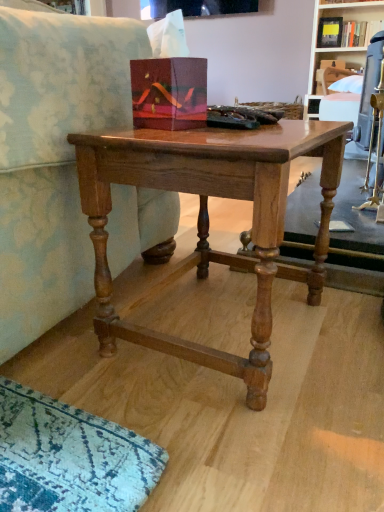
Question: Is point (329, 64) positioned closer to the camera than point (102, 201)?

Choices:
 (A) farther
 (B) closer

Answer: (A)

Question: Based on their sizes in the image, would you say wooden shelf at upper right, marked as the 1th shelf in a bottom-to-top arrangement, is bigger or smaller than shiny brown wood table at center?

Choices:
 (A) small
 (B) big

Answer: (A)

Question: Estimate the real-world distances between objects in this image. Which object is closer to the wooden bookshelf at upper right, which is the first shelf from top to bottom?

Choices:
 (A) shiny brown wood table at center
 (B) wooden shelf at upper right, positioned as the 2th shelf in top-to-bottom order

Answer: (B)

Question: Which of these objects is positioned closest to the wooden shelf at upper right, positioned as the 2th shelf in top-to-bottom order?

Choices:
 (A) wooden bookshelf at upper right, which is the first shelf from top to bottom
 (B) shiny brown wood table at center

Answer: (A)